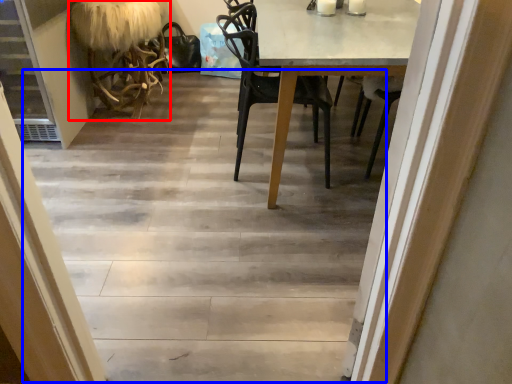
Question: Which object is closer to the camera taking this photo, armchair (highlighted by a red box) or stairwell (highlighted by a blue box)?

Choices:
 (A) armchair
 (B) stairwell

Answer: (B)